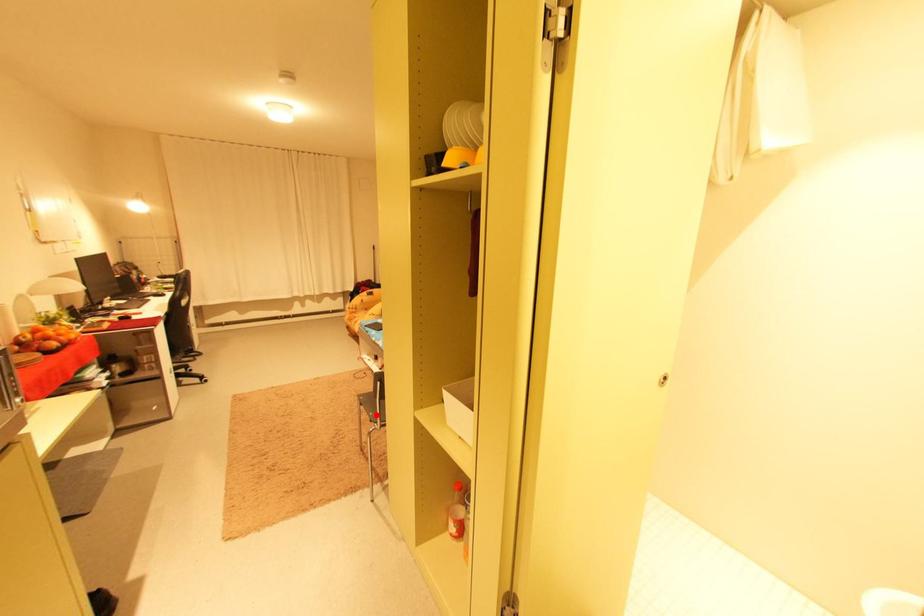
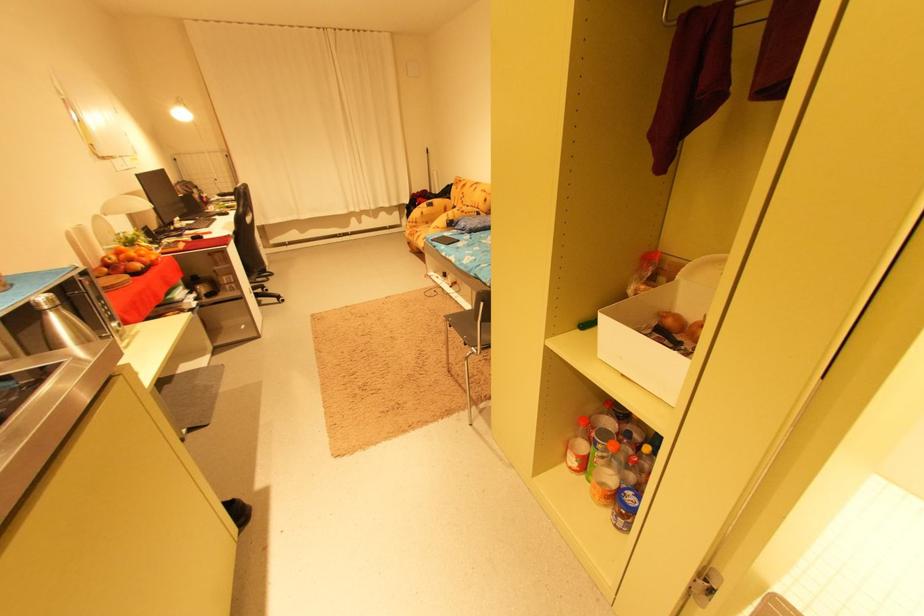
Question: I am providing you with two images of the same scene from different viewpoints. A red point is shown in image1. For the corresponding object point in image2, is it positioned nearer or farther from the camera?

Choices:
 (A) Nearer
 (B) Farther

Answer: (A)